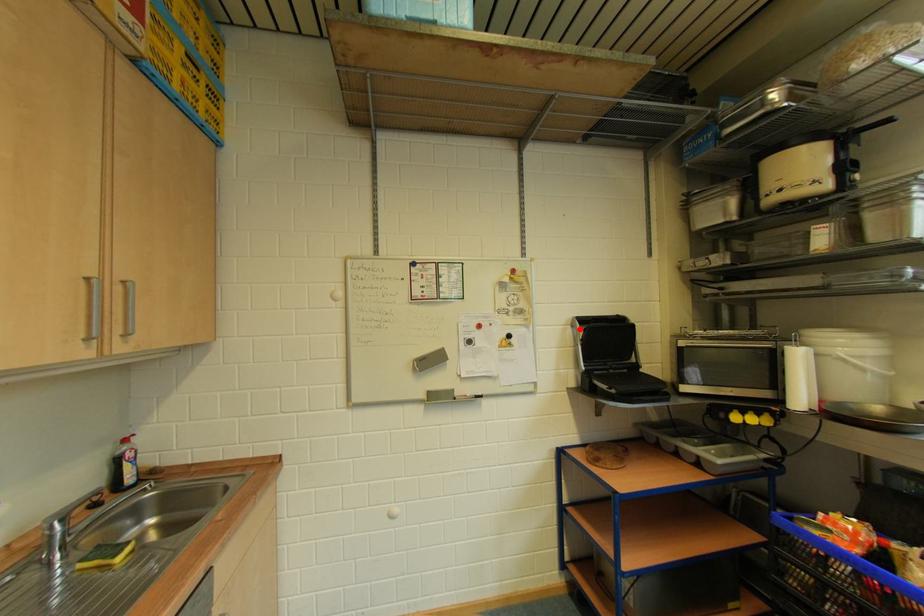
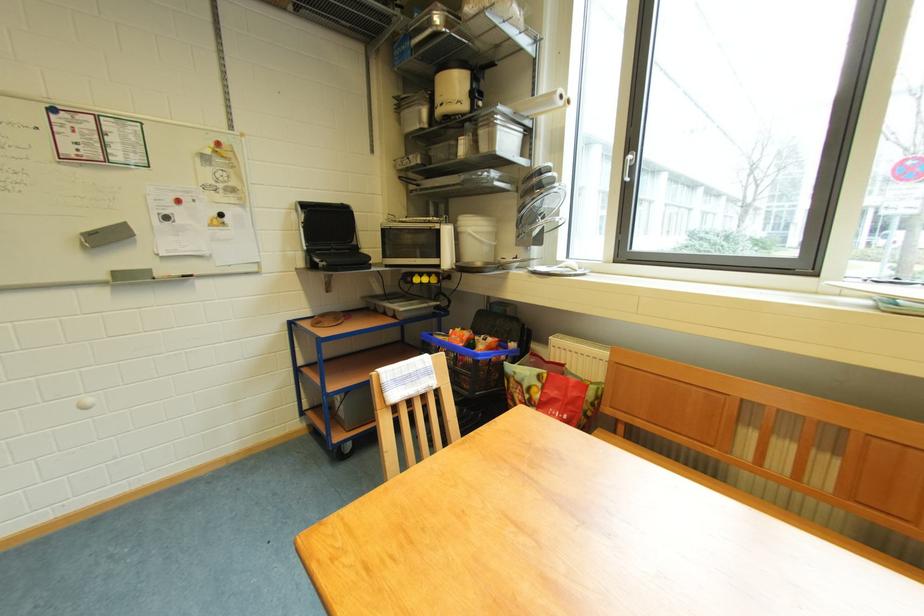
Where in the second image is the point corresponding to the highlighted location from the first image?

(305, 214)